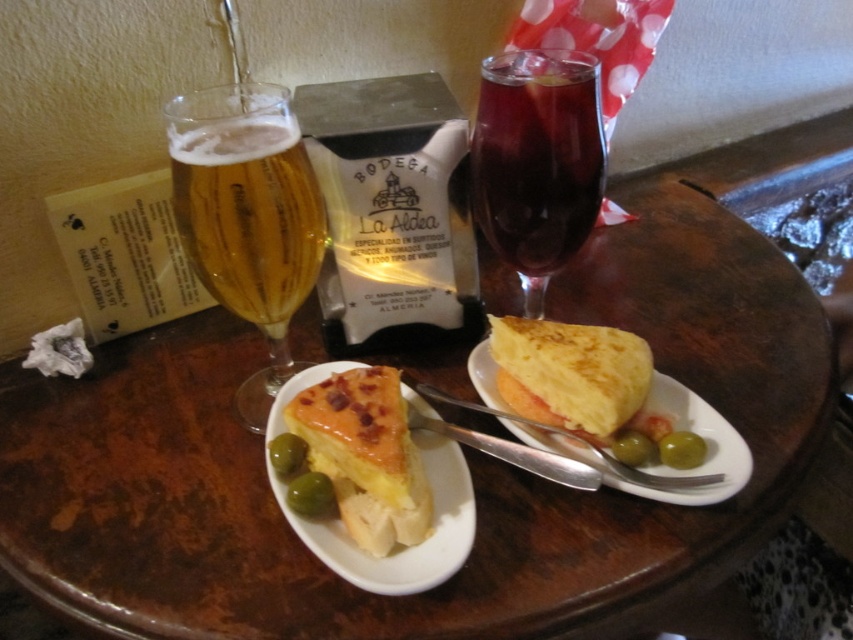
Which is more to the right, brown wooden table at center or green glossy olive at lower left?

brown wooden table at center

Is brown wooden table at center thinner than green glossy olive at lower left?

Incorrect, brown wooden table at center's width is not less than green glossy olive at lower left's.

Where is `brown wooden table at center`? This screenshot has width=853, height=640. brown wooden table at center is located at coordinates (466, 456).

You are a GUI agent. You are given a task and a screenshot of the screen. Output one action in this format:
    pyautogui.click(x=<x>, y=<y>)
    Task: Click on the brown wooden table at center
    The width and height of the screenshot is (853, 640).
    Given the screenshot: What is the action you would take?
    pyautogui.click(x=466, y=456)

What do you see at coordinates (466, 456) in the screenshot? I see `brown wooden table at center` at bounding box center [466, 456].

Is brown wooden table at center shorter than green glossy olives at lower left?

Incorrect, brown wooden table at center's height does not fall short of green glossy olives at lower left's.

Does point (27, 385) come in front of point (294, 468)?

No.

This screenshot has height=640, width=853. I want to click on brown wooden table at center, so click(x=466, y=456).

Between green glossy olives at lower left and green glossy olive at lower right, which one is positioned higher?

green glossy olive at lower right is higher up.

Is point (273, 458) closer to viewer compared to point (642, 436)?

Yes, it is in front of point (642, 436).

Which is behind, point (274, 440) or point (621, 444)?

Positioned behind is point (274, 440).

Locate an element on the screen. This screenshot has height=640, width=853. green glossy olives at lower left is located at coordinates (287, 454).